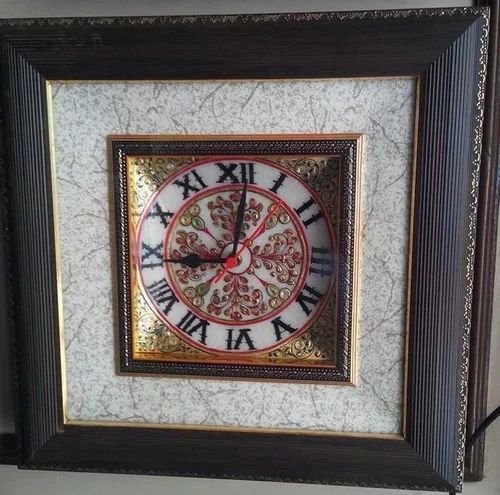
What are the coordinates of `gold highlights inside wooden frame edge` in the screenshot? It's located at (379, 437), (57, 361), (410, 246).